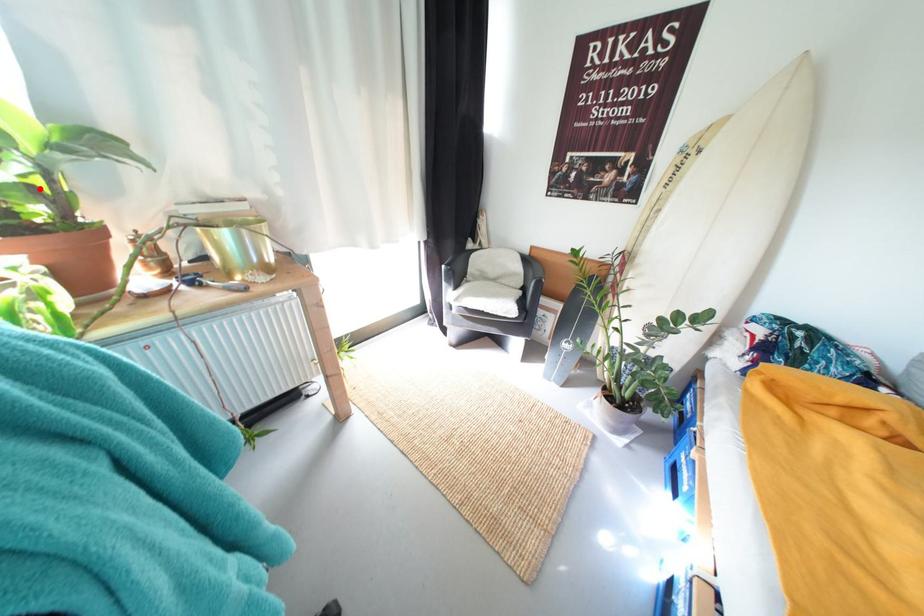
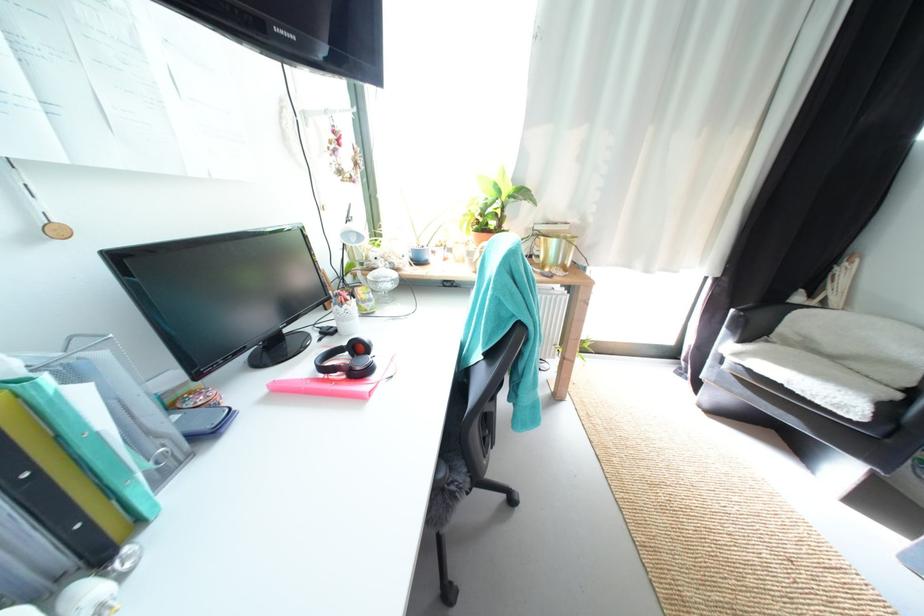
Question: A red point is marked in image1. In image2, is the corresponding 3D point closer to the camera or farther? Reply with the corresponding letter.

Choices:
 (A) The corresponding 3D point is closer.
 (B) The corresponding 3D point is farther.

Answer: (A)